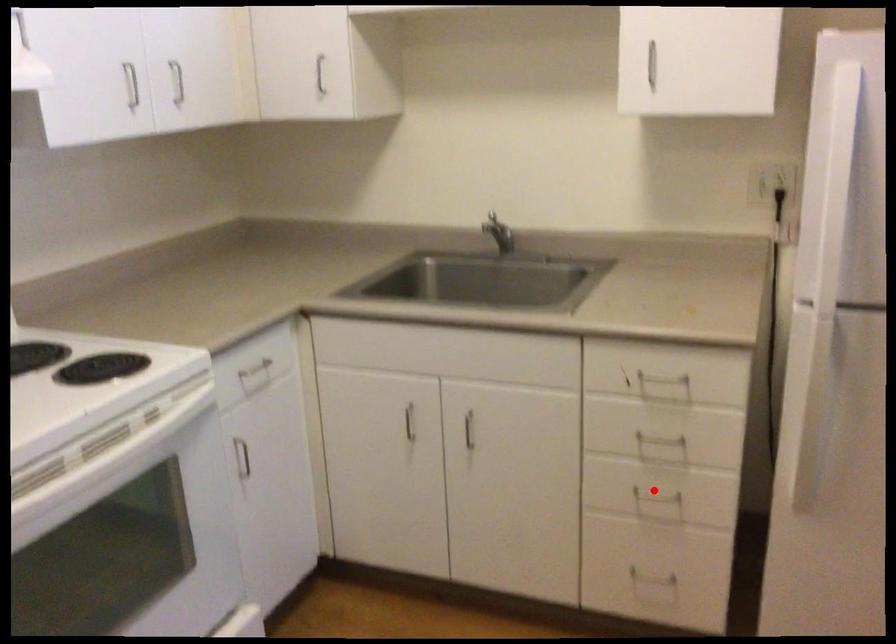
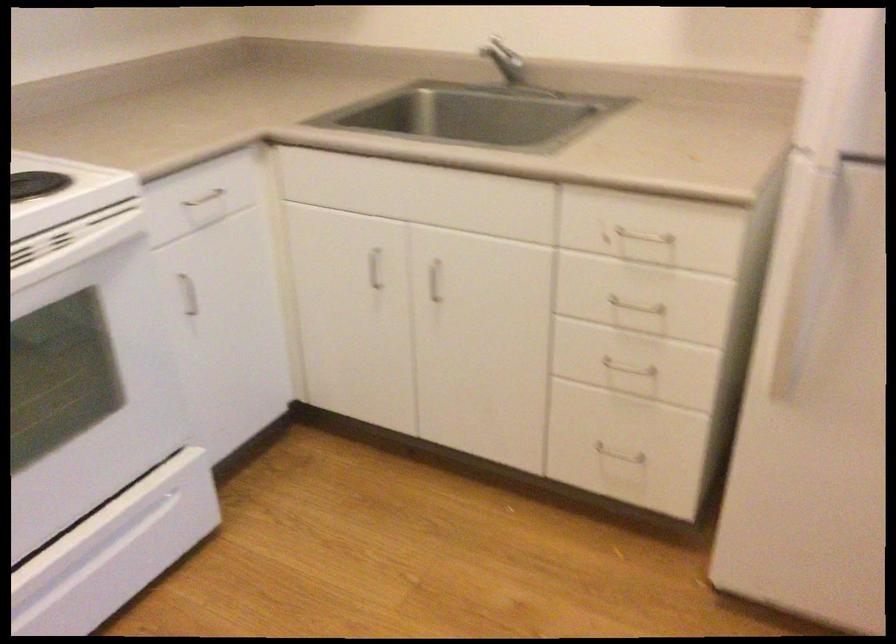
Where in the second image is the point corresponding to the highlighted location from the first image?

(624, 359)